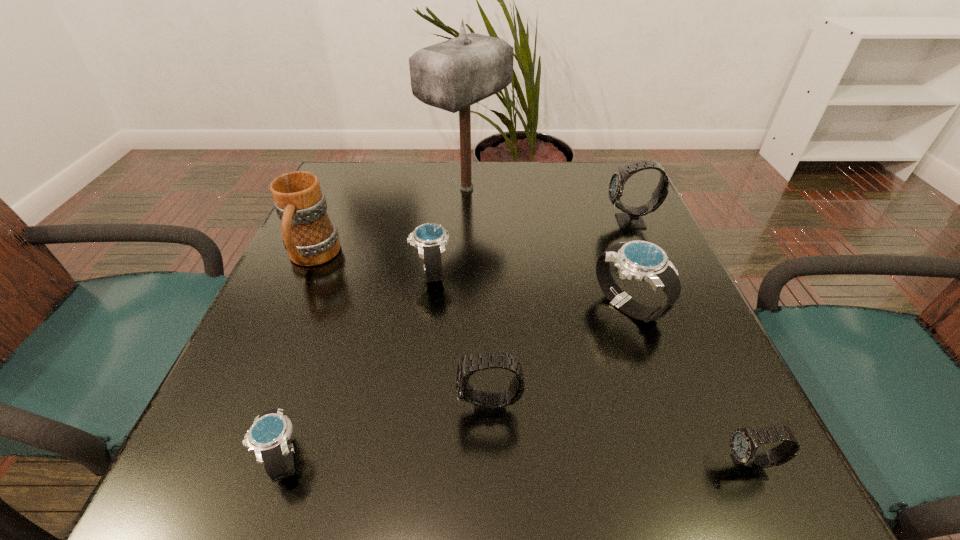
Locate which gray watch is the third closest to the biggest silver watch. Please provide its 2D coordinates. Your answer should be formatted as a tuple, i.e. [(x, y)], where the tuple contains the x and y coordinates of a point satisfying the conditions above.

[(744, 442)]

Locate which gray watch is the closest to the leftmost gray watch. Please provide its 2D coordinates. Your answer should be formatted as a tuple, i.e. [(x, y)], where the tuple contains the x and y coordinates of a point satisfying the conditions above.

[(744, 442)]

The width and height of the screenshot is (960, 540). I want to click on silver watch identified as the closest to the tallest object, so click(x=430, y=238).

Locate which silver watch is the closest to the second farthest gray watch. Please provide its 2D coordinates. Your answer should be formatted as a tuple, i.e. [(x, y)], where the tuple contains the x and y coordinates of a point satisfying the conditions above.

[(641, 260)]

Locate an element on the screen. free spot that satisfies the following two spatial constraints: 1. on the face of the second biggest gray watch; 2. on the front side of the leftmost watch is located at coordinates (490, 458).

What are the coordinates of `vacant space that satisfies the following two spatial constraints: 1. on the face of the farthest gray watch; 2. on the side of the mug with the handle` in the screenshot? It's located at (x=645, y=258).

Identify the location of vacant space that satisfies the following two spatial constraints: 1. on the front side of the biggest silver watch; 2. on the left side of the tallest object. (461, 306).